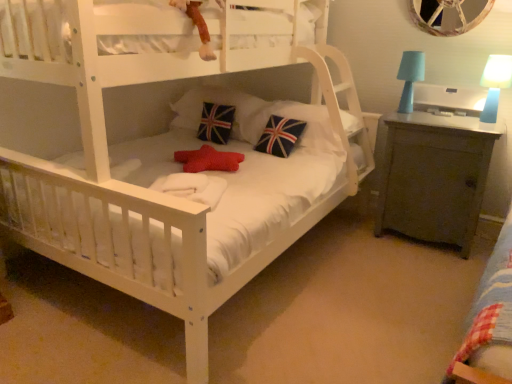
In order to click on vacant space to the left of blue plastic table lamp at upper right, which ranks as the second table lamp in left-to-right order in this screenshot , I will do `click(450, 121)`.